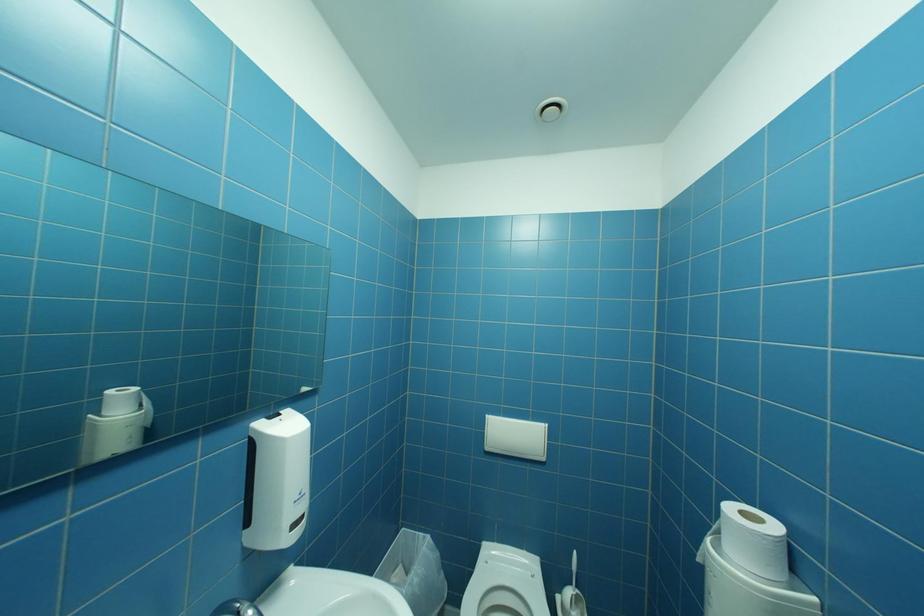
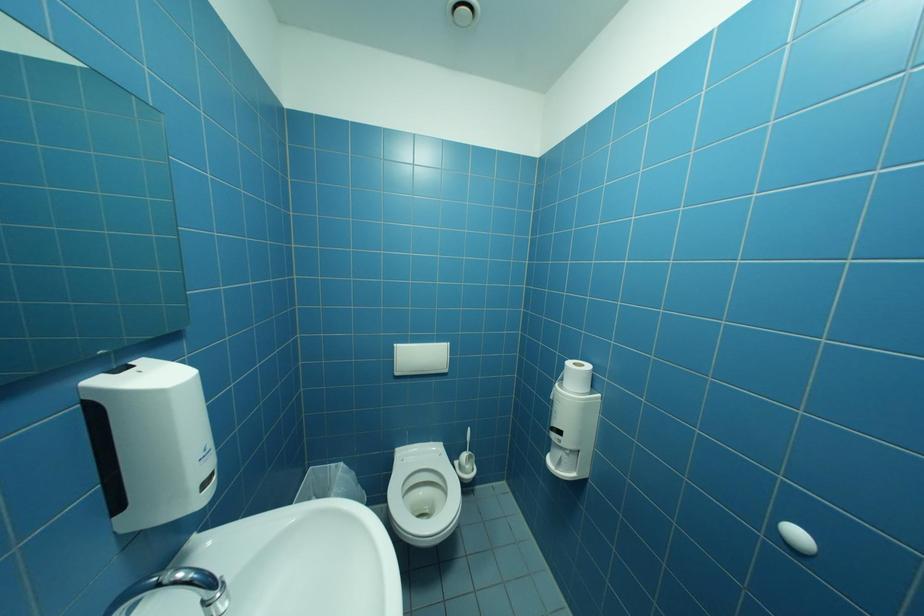
Question: The images are taken continuously from a first-person perspective. In which direction is your viewpoint rotating?

Choices:
 (A) Left
 (B) Right
 (C) Up
 (D) Down

Answer: (B)